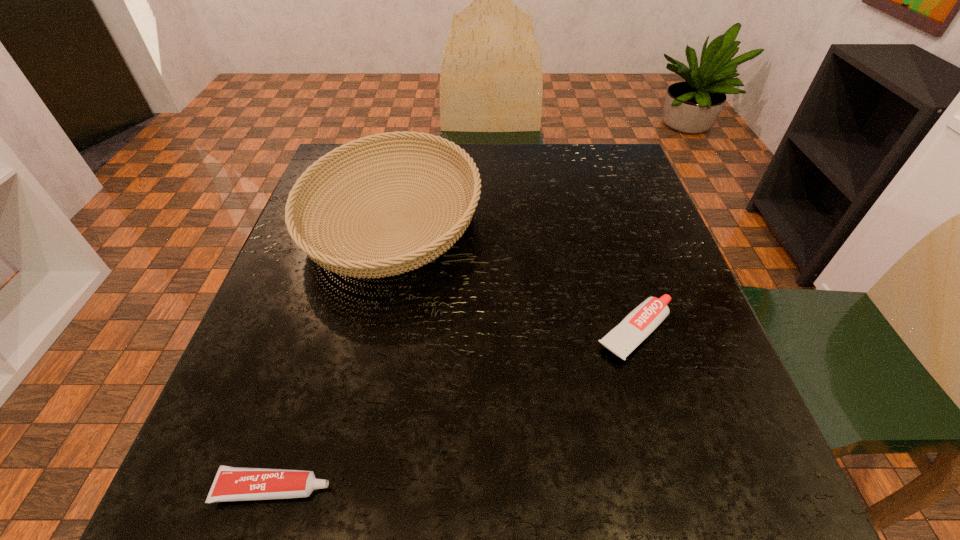
Locate an element on the screen. blank region between the farther toothpaste and the farthest object is located at coordinates (515, 276).

At what (x,y) coordinates should I click in order to perform the action: click on free point between the shorter toothpaste and the farther toothpaste. Please return your answer as a coordinate pair (x, y). Image resolution: width=960 pixels, height=540 pixels. Looking at the image, I should click on (455, 410).

The height and width of the screenshot is (540, 960). I want to click on free space between the right toothpaste and the basket, so click(515, 276).

Locate an element on the screen. vacant space that's between the farther toothpaste and the left toothpaste is located at coordinates (455, 410).

Where is `empty space that is in between the farthest object and the right toothpaste`? Image resolution: width=960 pixels, height=540 pixels. empty space that is in between the farthest object and the right toothpaste is located at coordinates (515, 276).

Locate an element on the screen. vacant region between the basket and the nearer toothpaste is located at coordinates (333, 354).

Locate an element on the screen. The height and width of the screenshot is (540, 960). vacant area that lies between the shorter toothpaste and the rightmost object is located at coordinates (455, 410).

Locate an element on the screen. free area in between the basket and the shorter toothpaste is located at coordinates (333, 354).

I want to click on vacant space that is in between the left toothpaste and the basket, so click(333, 354).

This screenshot has height=540, width=960. What are the coordinates of `free point between the farthest object and the rightmost object` in the screenshot? It's located at (515, 276).